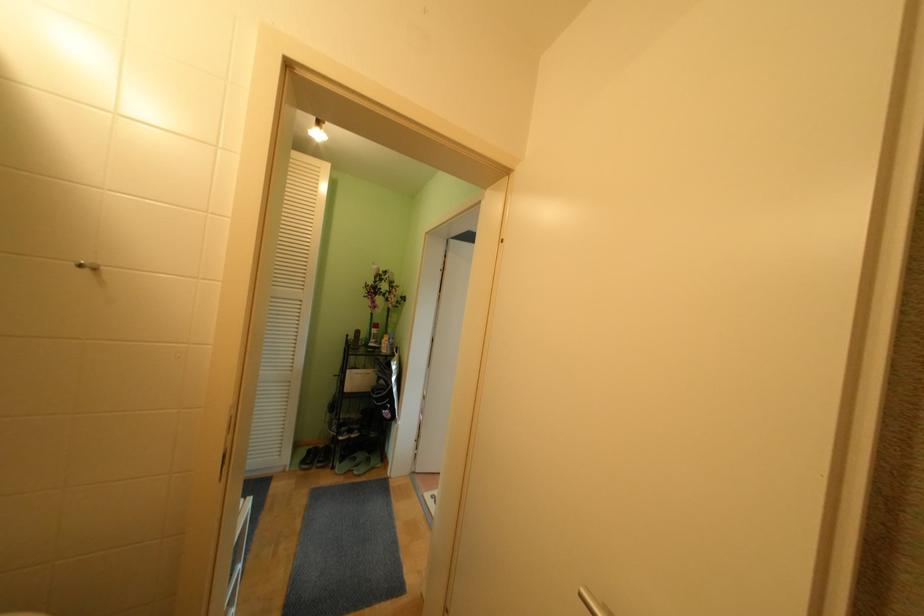
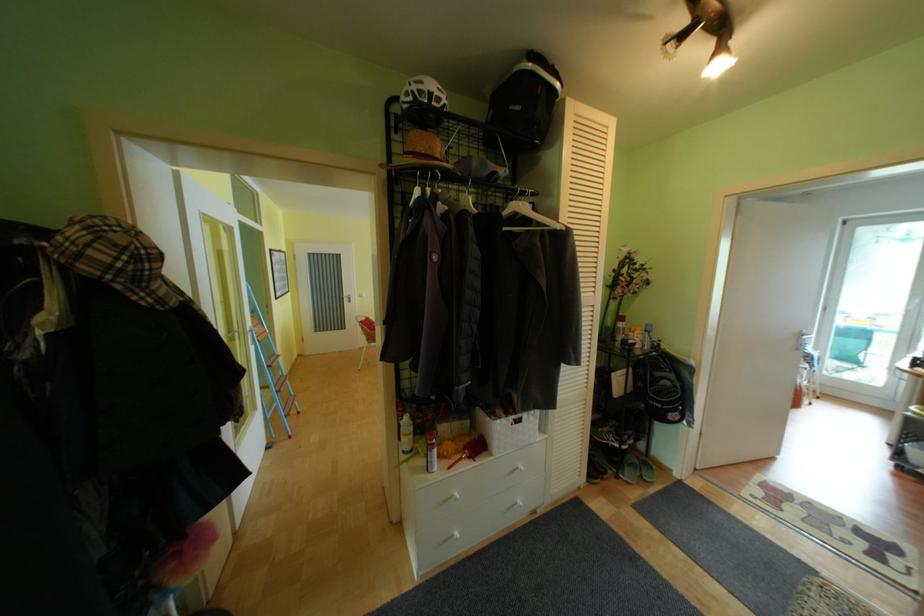
Question: Which direction would the cameraman need to move to produce the second image? Reply with the corresponding letter.

Choices:
 (A) Left
 (B) Right
 (C) Forward
 (D) Backward

Answer: (A)